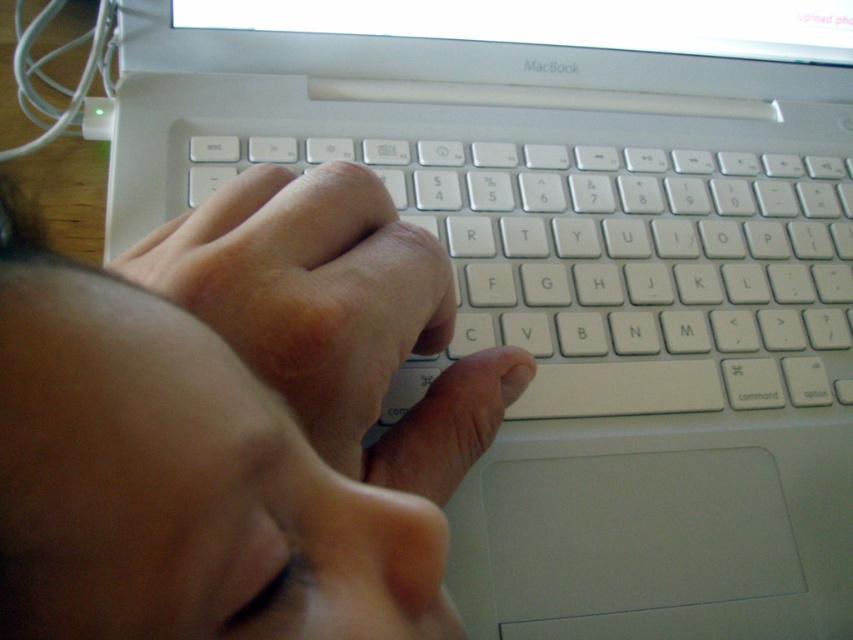
Who is positioned more to the right, matte white hand at center or white plastic keyboard at center?

white plastic keyboard at center

Looking at this image, can you confirm if matte white hand at center is taller than white plastic keyboard at center?

In fact, matte white hand at center may be shorter than white plastic keyboard at center.

Which is in front, point (206, 513) or point (494, 314)?

Point (206, 513) is in front.

The height and width of the screenshot is (640, 853). Find the location of `matte white hand at center`. matte white hand at center is located at coordinates (236, 422).